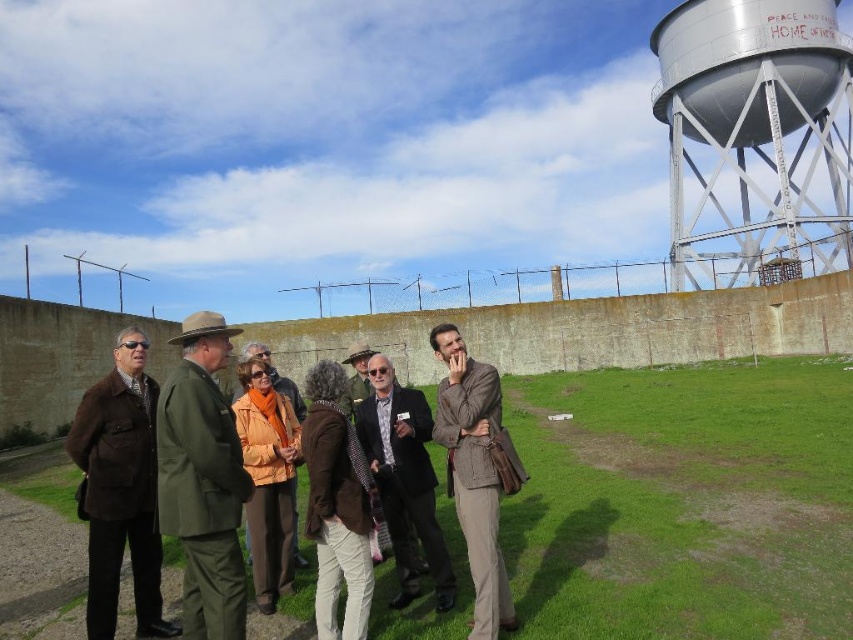
Does point (817, 8) come behind point (202, 534)?

That is True.

Where is `brushed metal water tower at upper right`? The width and height of the screenshot is (853, 640). brushed metal water tower at upper right is located at coordinates (755, 138).

Does brushed metal water tower at upper right appear over brown fur coat at center?

Indeed, brushed metal water tower at upper right is positioned over brown fur coat at center.

Is point (744, 17) farther from camera compared to point (100, 628)?

Yes, point (744, 17) is behind point (100, 628).

Is point (762, 112) closer to viewer compared to point (84, 433)?

No.

Locate an element on the screen. The width and height of the screenshot is (853, 640). brushed metal water tower at upper right is located at coordinates (755, 138).

Can you confirm if brushed metal water tower at upper right is positioned below dark brown leather jacket at center?

No.

Is brushed metal water tower at upper right taller than dark brown leather jacket at center?

Yes, brushed metal water tower at upper right is taller than dark brown leather jacket at center.

Find the location of a particular element. This screenshot has width=853, height=640. brushed metal water tower at upper right is located at coordinates tap(755, 138).